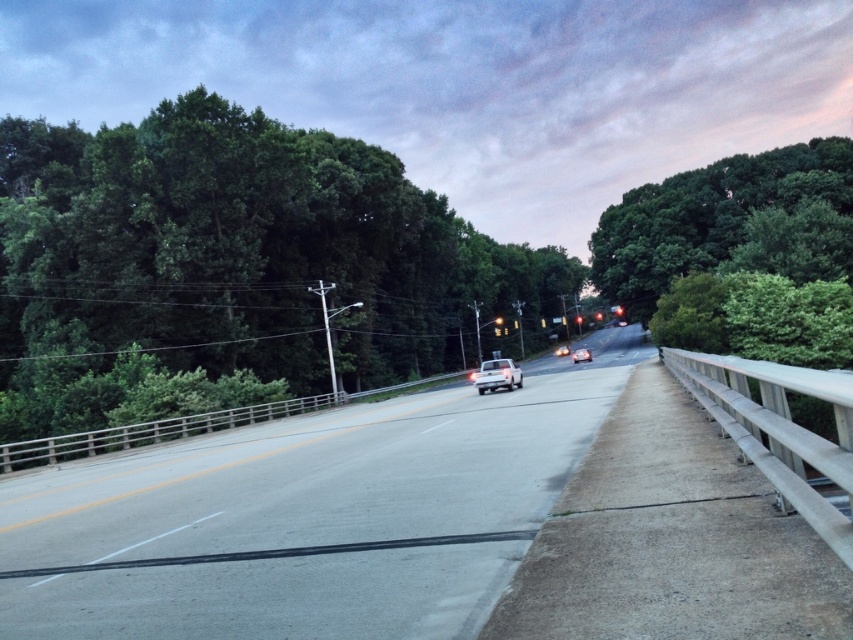
You are a photographer standing on the road and want to capture both the green leafy tree at upper right and the white matte car at center in your shot. Which object should you focus on first if you want to ensure both are in the frame?

The green leafy tree at upper right is taller than the white matte car at center, so you should focus on the green leafy tree at upper right first to ensure it fits within the frame.

In the scene shown: You are a pedestrian standing on the sidewalk next to the road. You see a shiny silver sedan at center and a red glass traffic light at center. Which object is narrower?

Result: The shiny silver sedan at center is narrower than the red glass traffic light at center according to the description.

Based on the scene description, which object takes up more area in the image? Please choose between the gray asphalt highway at center and the green leafy tree at upper right.

The green leafy tree at upper right occupies more area in the image than the gray asphalt highway at center according to the description.